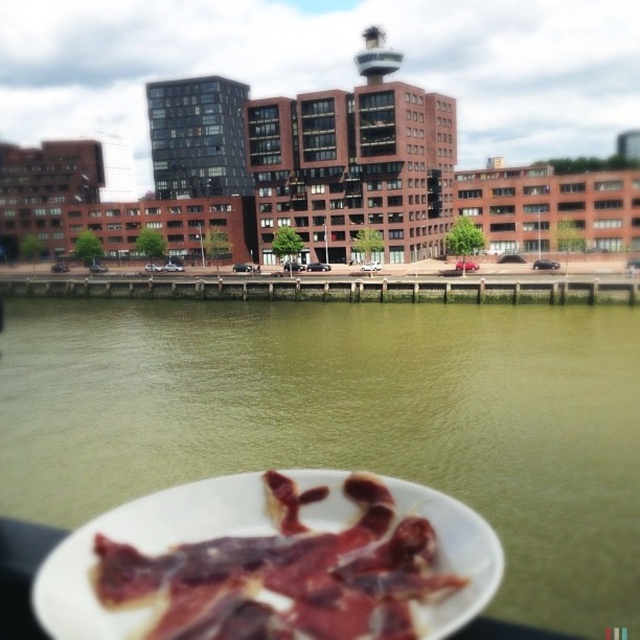
Does greenish water at lower center have a lesser height compared to sliced cured meat at bottom?

No, greenish water at lower center is not shorter than sliced cured meat at bottom.

Between greenish water at lower center and sliced cured meat at bottom, which one appears on the left side from the viewer's perspective?

From the viewer's perspective, greenish water at lower center appears more on the left side.

I want to click on greenish water at lower center, so click(x=348, y=419).

This screenshot has width=640, height=640. Identify the location of greenish water at lower center. (348, 419).